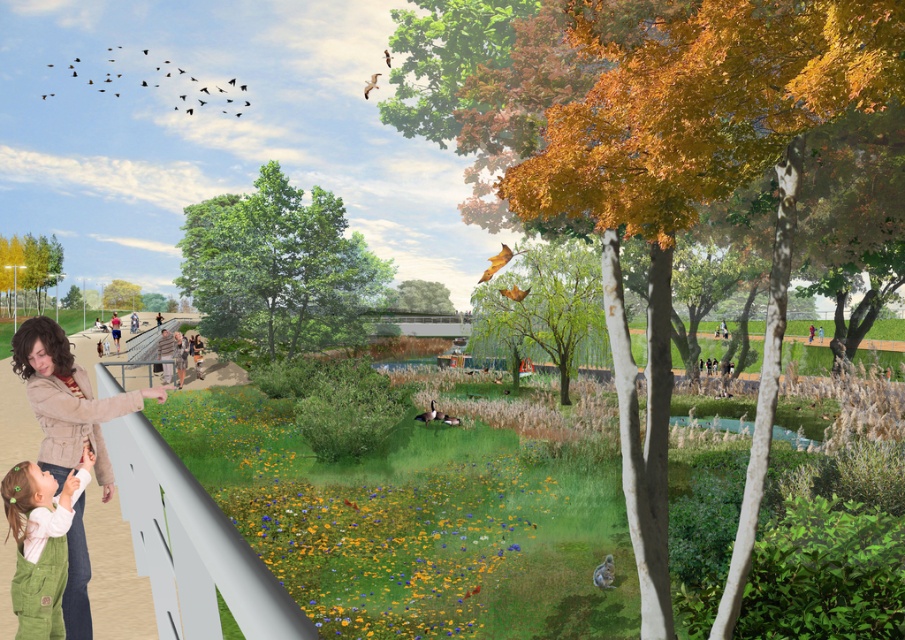
Question: Which object is farther from the camera taking this photo?

Choices:
 (A) green corduroy overalls at lower left
 (B) matte beige jacket at lower left

Answer: (B)

Question: Can you confirm if matte beige jacket at lower left is positioned below green corduroy overalls at lower left?

Choices:
 (A) yes
 (B) no

Answer: (B)

Question: Which object appears farthest from the camera in this image?

Choices:
 (A) green corduroy overalls at lower left
 (B) matte beige jacket at lower left

Answer: (B)

Question: In this image, where is matte beige jacket at lower left located relative to green corduroy overalls at lower left?

Choices:
 (A) above
 (B) below

Answer: (A)

Question: Is matte beige jacket at lower left to the right of green corduroy overalls at lower left from the viewer's perspective?

Choices:
 (A) no
 (B) yes

Answer: (A)